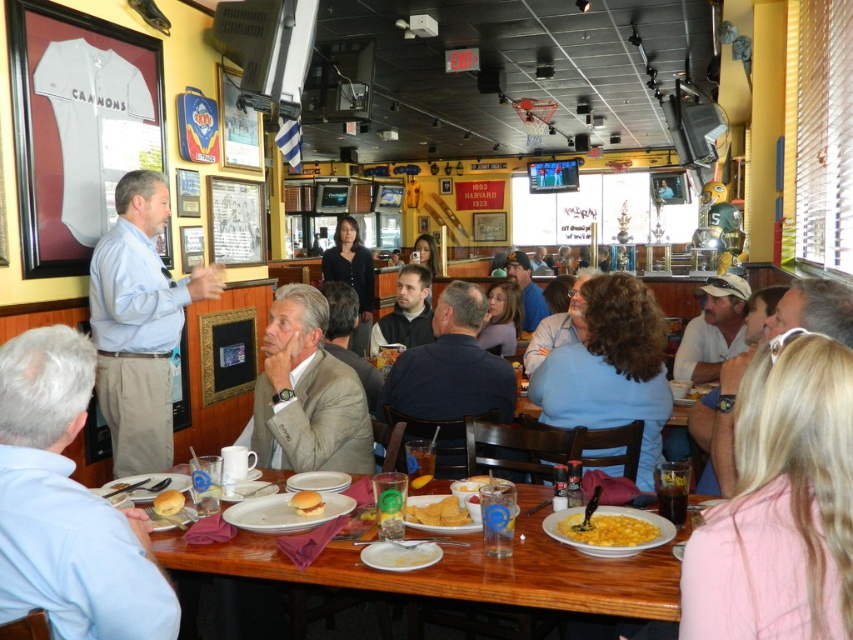
Consider the image. You are a customer sitting at the table in the sports restaurant. You want to grab the yellow matte corn at lower center but there is a light blue shirt at left in your way. Can you reach the corn without moving the person?

The yellow matte corn at lower center is behind the light blue shirt at left, so you cannot reach it without moving the person in the light blue shirt at left.

You are a server in the sports restaurant and need to place a large platter of food on the table. The platter is as big as the gray suit at center. Will it fit on the wooden table at lower center?

The gray suit at center occupies less space than wooden table at lower center. Since the platter is as big as the gray suit at center, it will fit on the wooden table at lower center because the table is larger in space.